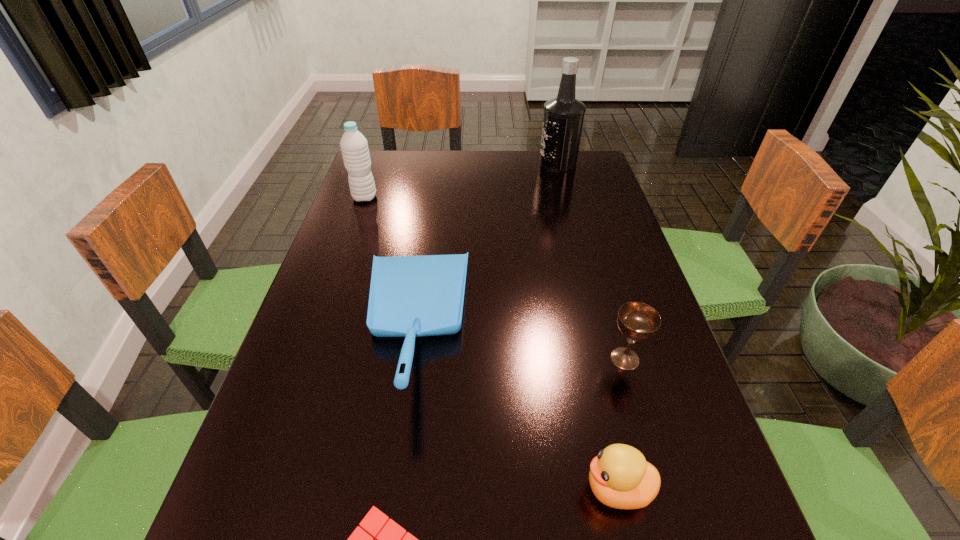
The height and width of the screenshot is (540, 960). Identify the location of liquor located in the right edge section of the desktop. (563, 118).

The image size is (960, 540). I want to click on chalice positioned at the right edge, so click(638, 321).

This screenshot has height=540, width=960. I want to click on duckling at the right edge, so click(620, 477).

Locate an element on the screen. object present at the far right corner is located at coordinates (563, 118).

Where is `vacant space at the far edge of the desktop`? This screenshot has width=960, height=540. vacant space at the far edge of the desktop is located at coordinates (474, 156).

Image resolution: width=960 pixels, height=540 pixels. Find the location of `free space at the left edge of the desktop`. free space at the left edge of the desktop is located at coordinates (389, 227).

I want to click on blank space at the right edge, so click(628, 298).

Find the location of `vacant region between the dustpan and the liquor`. vacant region between the dustpan and the liquor is located at coordinates (485, 245).

Find the location of a particular element. free space between the chalice and the farthest object is located at coordinates (591, 261).

Locate an element on the screen. vacant point located between the dustpan and the second shortest object is located at coordinates (515, 407).